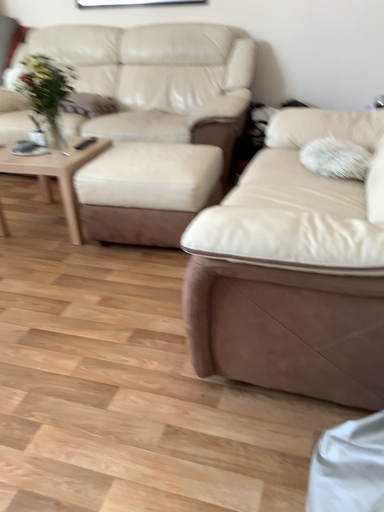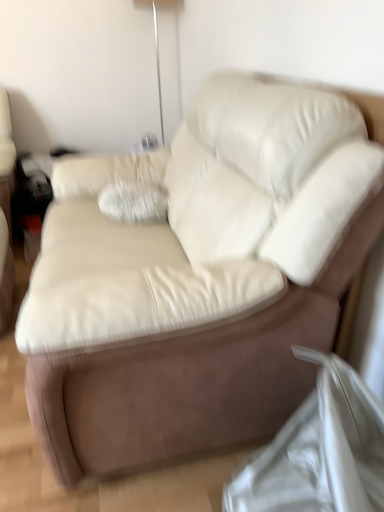
Question: Which way did the camera rotate in the video?

Choices:
 (A) rotated right
 (B) rotated left

Answer: (A)